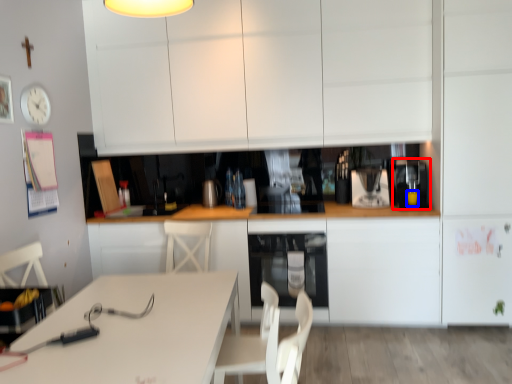
Question: Which point is closer to the camera, coffee machine (highlighted by a red box) or beverage (highlighted by a blue box)?

Choices:
 (A) coffee machine
 (B) beverage

Answer: (A)